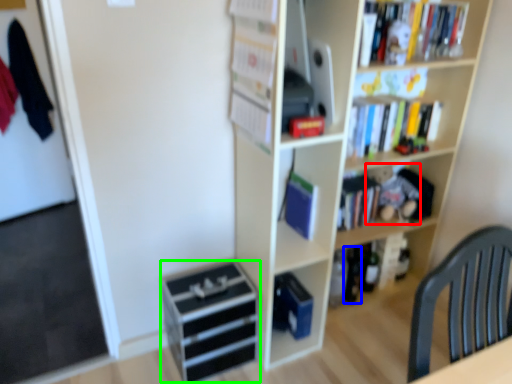
Question: Which object is the farthest from toy (highlighted by a red box)? Choose among these: beer bottle (highlighted by a blue box) or drawer (highlighted by a green box).

Choices:
 (A) beer bottle
 (B) drawer

Answer: (B)